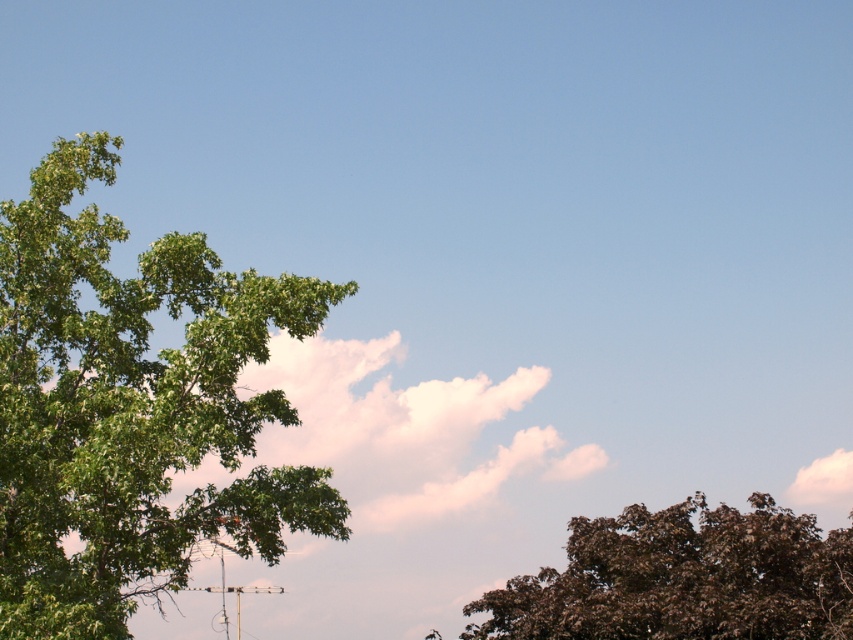
You are standing at point (131, 408) in the sky scene. Which direction should you walk to reach the green leafy tree at left?

The point (131, 408) is located at the green leafy tree at left, so you are already there.

You are standing at the center of the image and want to locate the green leafy tree at left. Based on the coordinates provided, in which direction should you look to find it?

The green leafy tree at left is located at coordinates 0.639 on the x axis and 0.155 on the y axis. Since the x value is greater than 0.5, you should look to the right from the center to find it.